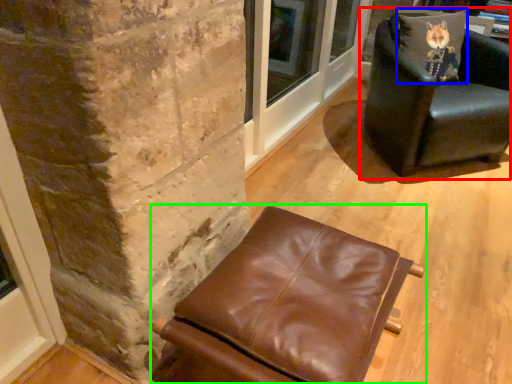
Question: Which object is the farthest from chair (highlighted by a red box)? Choose among these: pillow (highlighted by a blue box) or chair (highlighted by a green box).

Choices:
 (A) pillow
 (B) chair

Answer: (B)